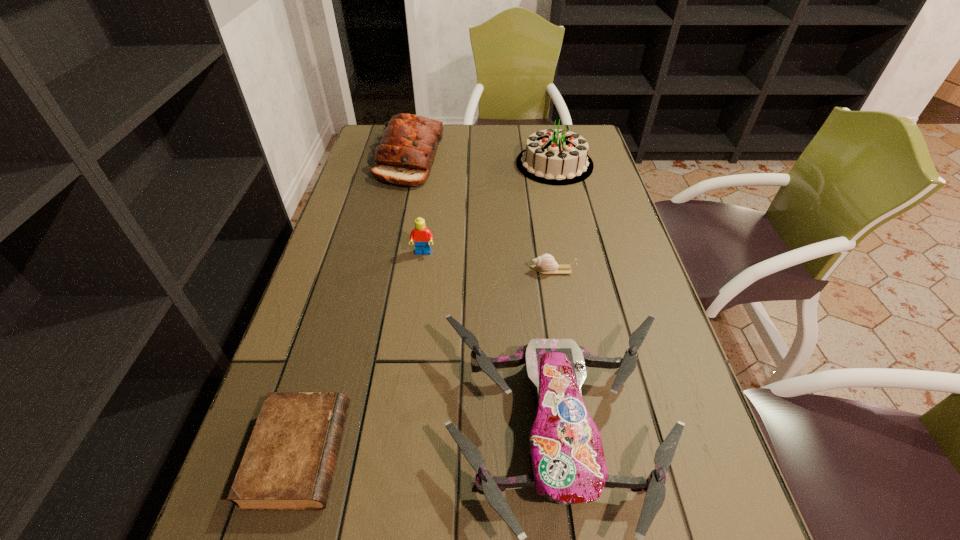
Image resolution: width=960 pixels, height=540 pixels. I want to click on free space located 0.160m on the shell of the third nearest object, so click(465, 271).

At what (x,y) coordinates should I click in order to perform the action: click on free region located 0.290m on the shell of the third nearest object. Please return your answer as a coordinate pair (x, y). The width and height of the screenshot is (960, 540). Looking at the image, I should click on (411, 271).

Where is `birthday cake that is positioned at the far edge`? This screenshot has height=540, width=960. birthday cake that is positioned at the far edge is located at coordinates (558, 157).

This screenshot has height=540, width=960. I want to click on bread positioned at the far edge, so click(409, 143).

This screenshot has height=540, width=960. Find the location of `bread at the left edge`. bread at the left edge is located at coordinates (409, 143).

You are a GUI agent. You are given a task and a screenshot of the screen. Output one action in this format:
    pyautogui.click(x=<x>, y=<y>)
    Task: Click on the diary at the left edge
    
    Given the screenshot: What is the action you would take?
    pyautogui.click(x=288, y=465)

Identify the location of object situated at the right edge. (558, 157).

Where is `object present at the far left corner`? The height and width of the screenshot is (540, 960). object present at the far left corner is located at coordinates (409, 143).

Identify the location of object that is positioned at the far right corner. (558, 157).

Locate an element on the screen. This screenshot has width=960, height=540. vacant space at the far edge of the desktop is located at coordinates (472, 126).